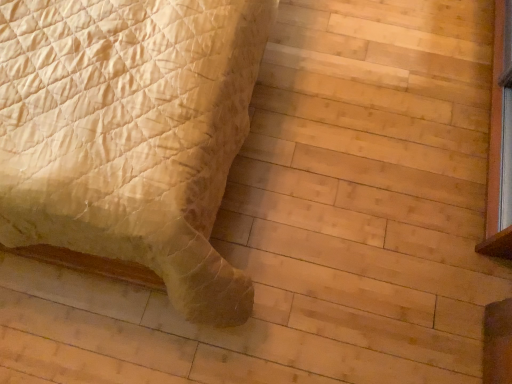
I want to click on quilted beige bed at lower left, so click(130, 134).

Describe the element at coordinates (130, 134) in the screenshot. I see `quilted beige bed at lower left` at that location.

What is the approximate height of quilted beige bed at lower left?

35.76 inches.

Where is `quilted beige bed at lower left`? Image resolution: width=512 pixels, height=384 pixels. quilted beige bed at lower left is located at coordinates (130, 134).